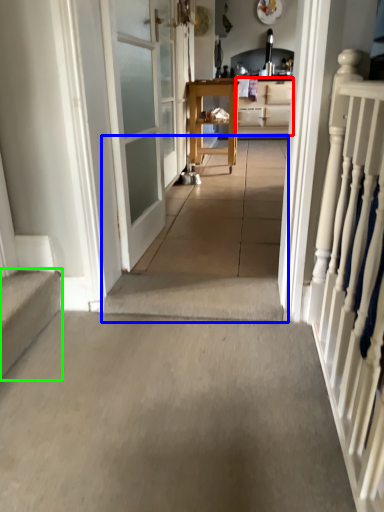
Question: Which object is positioned closest to cabinetry (highlighted by a red box)? Select from path (highlighted by a blue box) and stairs (highlighted by a green box).

Choices:
 (A) path
 (B) stairs

Answer: (A)